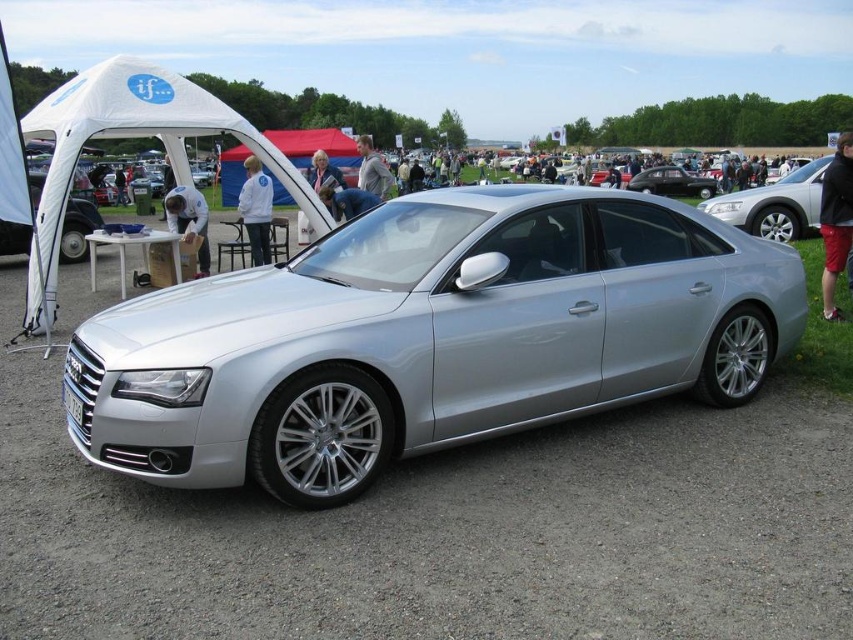
Who is positioned more to the left, silver metallic car at center or shiny black car at center?

From the viewer's perspective, silver metallic car at center appears more on the left side.

Which is behind, point (247, 310) or point (689, 177)?

Point (689, 177)

Is point (231, 477) closer to viewer compared to point (677, 195)?

Yes, point (231, 477) is in front of point (677, 195).

What are the coordinates of `silver metallic car at center` in the screenshot? It's located at (428, 337).

Consider the image. Who is taller, white fabric tent at upper left or satin silver car at center?

white fabric tent at upper left is taller.

Between white fabric tent at upper left and satin silver car at center, which one appears on the left side from the viewer's perspective?

white fabric tent at upper left

Where is `white fabric tent at upper left`? white fabric tent at upper left is located at coordinates click(131, 138).

Find the location of a particular element. The height and width of the screenshot is (640, 853). white fabric tent at upper left is located at coordinates (131, 138).

Between point (659, 332) and point (795, 228), which one is positioned in front?

Positioned in front is point (659, 332).

Between silver metallic car at center and satin silver car at center, which one is positioned higher?

satin silver car at center is higher up.

Which is in front, point (120, 374) or point (770, 188)?

Point (120, 374)

You are a GUI agent. You are given a task and a screenshot of the screen. Output one action in this format:
    pyautogui.click(x=<x>, y=<y>)
    Task: Click on the silver metallic car at center
    Image resolution: width=853 pixels, height=640 pixels.
    Given the screenshot: What is the action you would take?
    pyautogui.click(x=428, y=337)